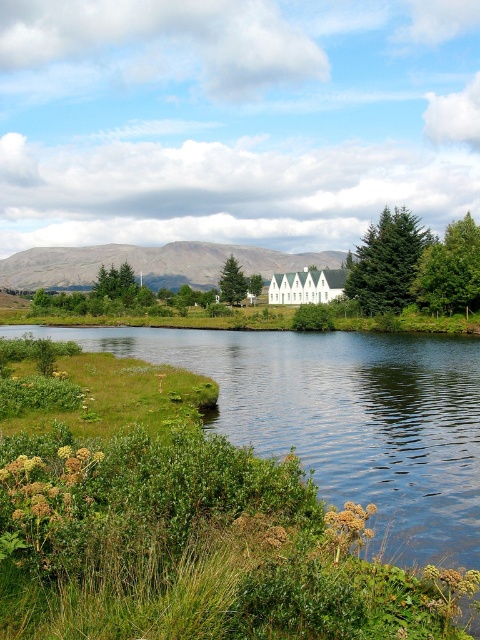
Which is below, green matte evergreen tree at center-right or green matte tree at center?

green matte evergreen tree at center-right

Is green matte evergreen tree at center-right below green matte tree at center?

Correct, green matte evergreen tree at center-right is located below green matte tree at center.

You are a GUI agent. You are given a task and a screenshot of the screen. Output one action in this format:
    pyautogui.click(x=<x>, y=<y>)
    Task: Click on the green matte evergreen tree at center-right
    
    Given the screenshot: What is the action you would take?
    pyautogui.click(x=386, y=262)

Which is in front, point (431, 248) or point (224, 298)?

Point (431, 248) is more forward.

Does green leafy tree at right appear under green matte tree at center?

Correct, green leafy tree at right is located below green matte tree at center.

Which is in front, point (452, 230) or point (227, 266)?

Point (452, 230)

The width and height of the screenshot is (480, 640). I want to click on green leafy tree at right, so click(450, 269).

At what (x,y) coordinates should I click in order to perform the action: click on green grassy river at lower center. Please return your answer as a coordinate pair (x, y). This screenshot has height=640, width=480. Looking at the image, I should click on (343, 419).

Is green grassy river at lower center smaller than green matte evergreen tree at center-right?

No.

The height and width of the screenshot is (640, 480). Find the location of `green grassy river at lower center`. green grassy river at lower center is located at coordinates (343, 419).